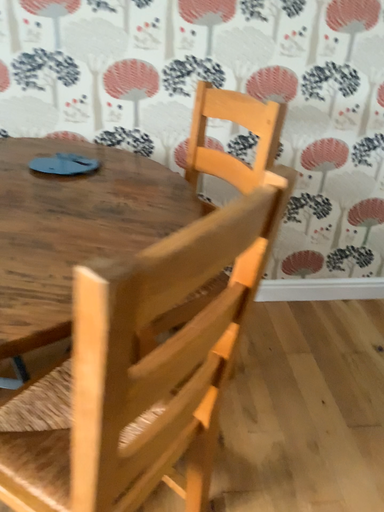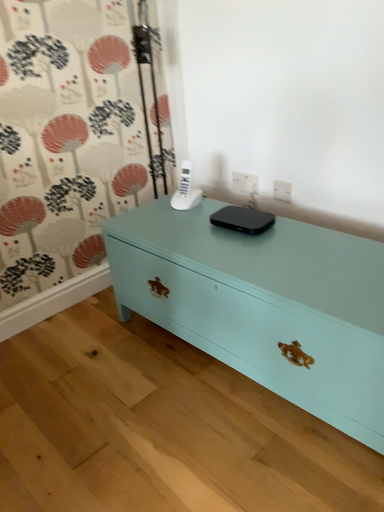
Question: Which way did the camera rotate in the video?

Choices:
 (A) rotated left
 (B) rotated right

Answer: (B)